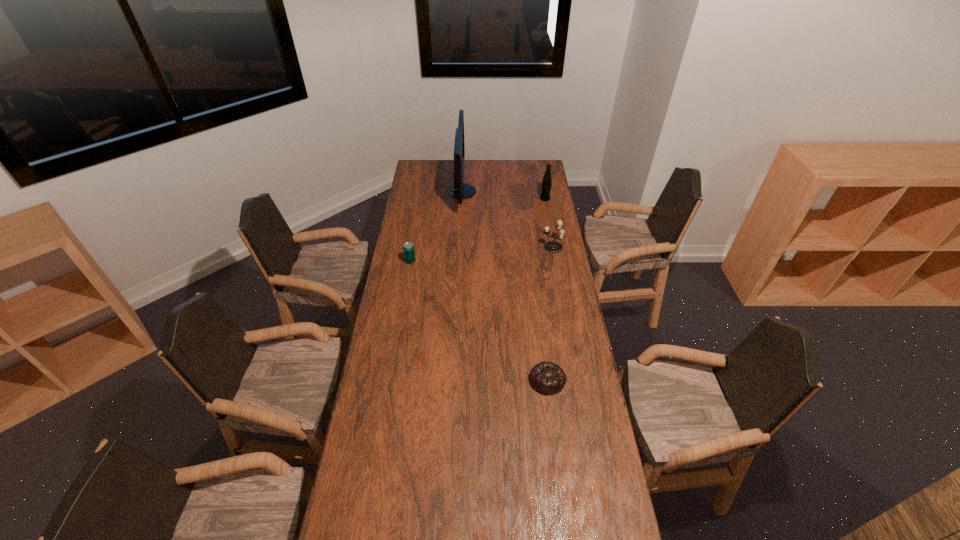
Identify the location of free space located on the front of the second tallest object. (551, 232).

The image size is (960, 540). In order to click on free space located 0.370m on the front of the third nearest object in this screenshot , I will do `click(564, 312)`.

This screenshot has height=540, width=960. In order to click on vacant space located 0.090m on the right of the fourth farthest object in this screenshot , I will do 435,261.

This screenshot has width=960, height=540. Identify the location of vacant space situated on the front of the shortest object. (563, 496).

This screenshot has width=960, height=540. In order to click on object that is at the far edge in this screenshot , I will do `click(460, 190)`.

Where is `object present at the left edge`? object present at the left edge is located at coordinates (409, 254).

Identify the location of beer bottle located in the right edge section of the desktop. (546, 185).

Find the location of a particular element. The height and width of the screenshot is (540, 960). candle holder that is positioned at the right edge is located at coordinates (551, 246).

Where is `beanbag that is at the right edge`? beanbag that is at the right edge is located at coordinates (548, 378).

Identify the location of blank space at the far edge of the desktop. (471, 180).